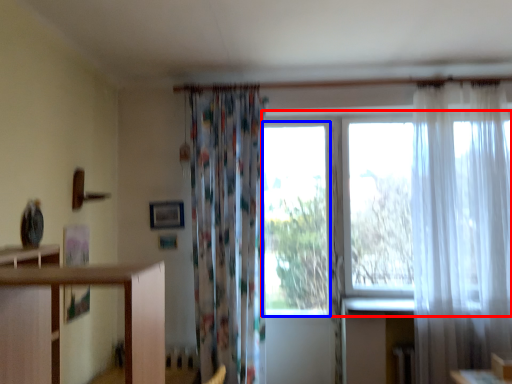
Question: Which point is further to the camera, window screen (highlighted by a red box) or window (highlighted by a blue box)?

Choices:
 (A) window screen
 (B) window

Answer: (B)